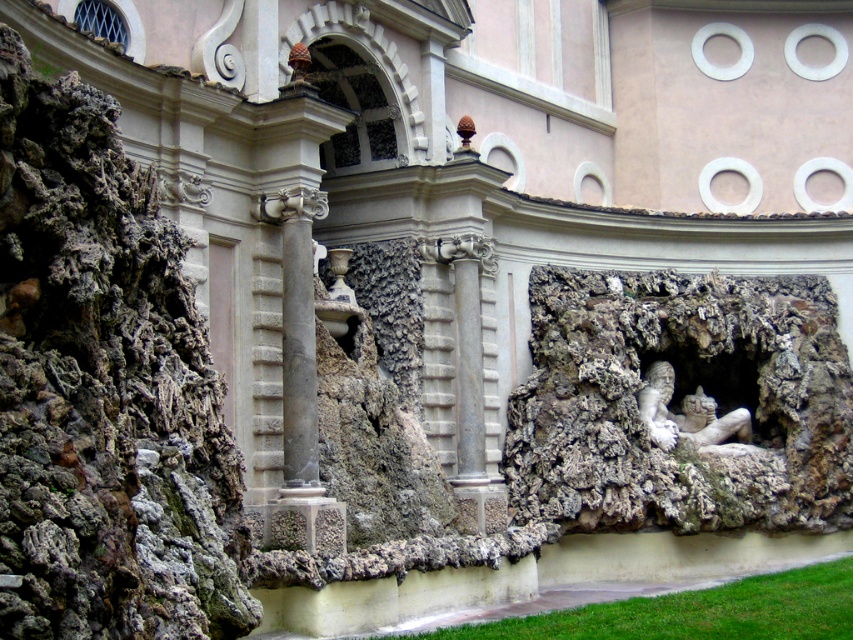
You are standing in front of the building and notice two points marked on its facade. The first point is at coordinates point (540, 310) and the second is at point (720, 429). Which of these points is closer to your current position?

Point (540, 310) is in front of point (720, 429), so it is closer to your current position.

You are standing in front of the building and want to locate the rough stone carving at center. According to the coordinates provided, where should you look relative to the building?

The rough stone carving at center is located at coordinates point (680, 403), which means it is positioned approximately 63.1 percent from the left edge and 79.8 percent from the bottom edge of the building structure.